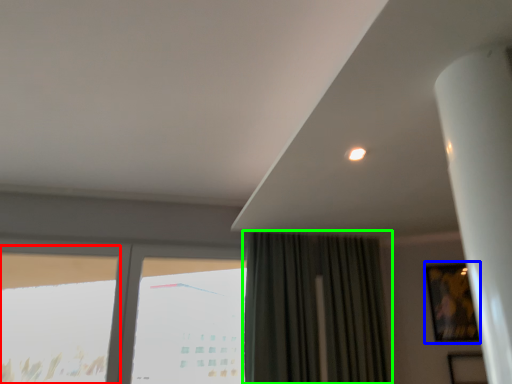
Question: Considering the real-world distances, which object is farthest from window (highlighted by a red box)? picture frame (highlighted by a blue box) or curtain (highlighted by a green box)?

Choices:
 (A) picture frame
 (B) curtain

Answer: (A)